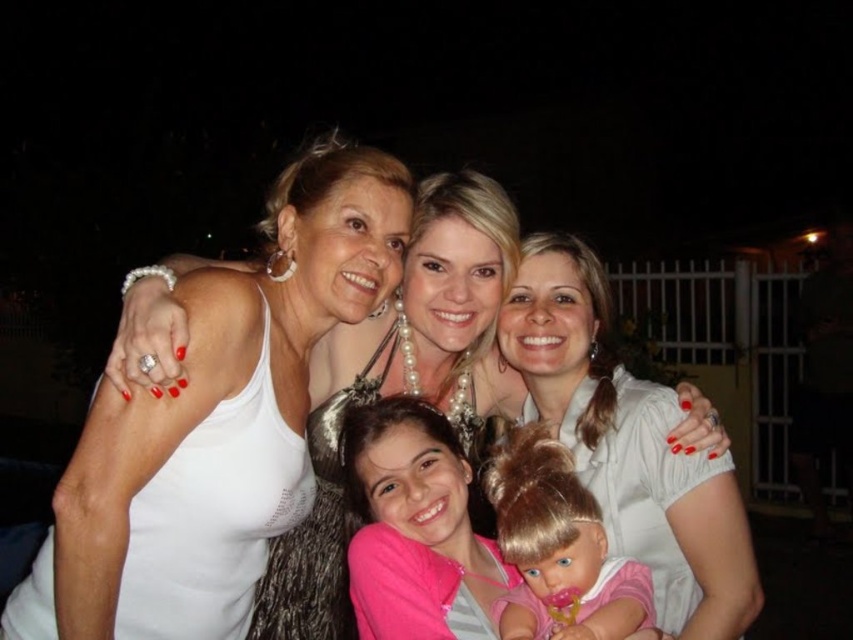
Who is taller, white fabric dress at upper left or smooth plastic doll at center?

white fabric dress at upper left is taller.

Between white fabric dress at upper left and smooth plastic doll at center, which one has less height?

With less height is smooth plastic doll at center.

Does point (236, 516) come in front of point (494, 484)?

Yes, point (236, 516) is closer to viewer.

Where is `white fabric dress at upper left`? Image resolution: width=853 pixels, height=640 pixels. white fabric dress at upper left is located at coordinates (213, 515).

Which of these two, white satin blouse at center or white fabric dress at upper left, stands taller?

white satin blouse at center is taller.

Does white satin blouse at center appear on the right side of white fabric dress at upper left?

Correct, you'll find white satin blouse at center to the right of white fabric dress at upper left.

Does point (601, 449) come in front of point (193, 528)?

No.

This screenshot has height=640, width=853. Find the location of `white satin blouse at center`. white satin blouse at center is located at coordinates (631, 444).

Is white satin blouse at center thinner than sparkly silver dress at center?

No.

Can you confirm if white satin blouse at center is positioned to the left of sparkly silver dress at center?

Result: Incorrect, white satin blouse at center is not on the left side of sparkly silver dress at center.

Is point (752, 552) farther from camera compared to point (310, 580)?

No, it is not.

Find the location of a particular element. The height and width of the screenshot is (640, 853). white satin blouse at center is located at coordinates (631, 444).